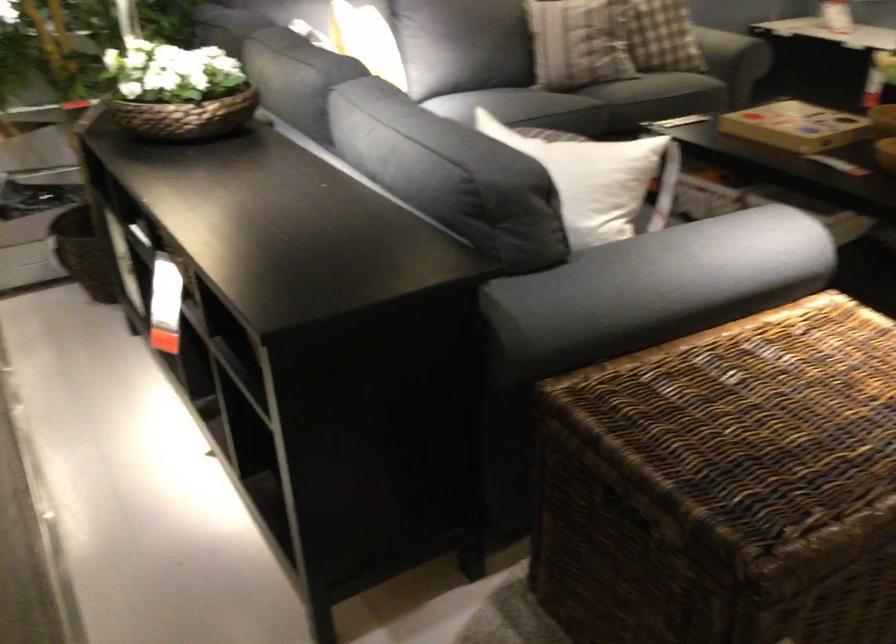
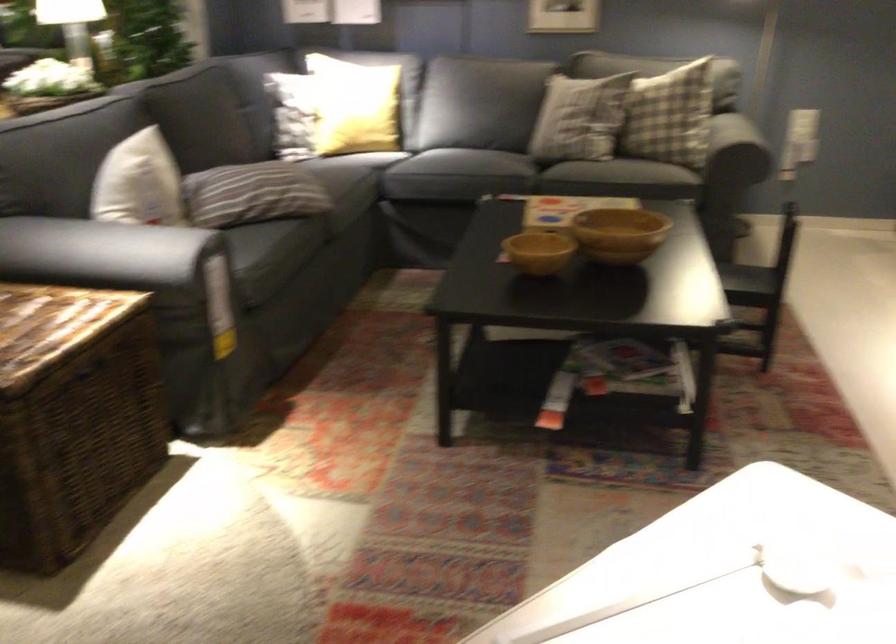
Question: I am providing you with two images of the same scene from different viewpoints. Which of the following objects are not visible in image2?

Choices:
 (A) large wooden bowl
 (B) dark sofa armrest
 (C) yellow pillow
 (D) none of these

Answer: (D)